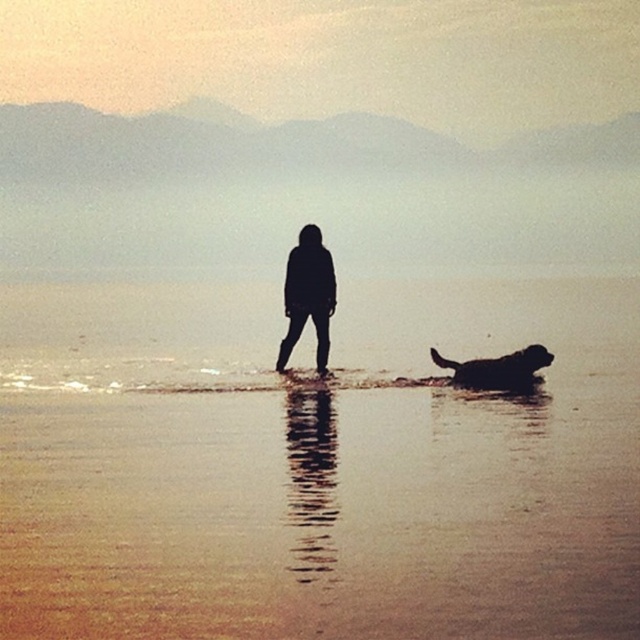
You are a photographer trying to capture the reflection of both the person and the dog in the smooth sand water at center. Since the black matte dog at lower right is smaller, will its reflection be harder to see compared to the person?

The smooth sand water at center is larger than the black matte dog at lower right, so the dog is smaller. Therefore, its reflection might be harder to see compared to the person.

You are standing on the beach and see the smooth sand water at center and the black matte figure at center. Which object is nearer to you?

The smooth sand water at center is closer to the viewer than the black matte figure at center.